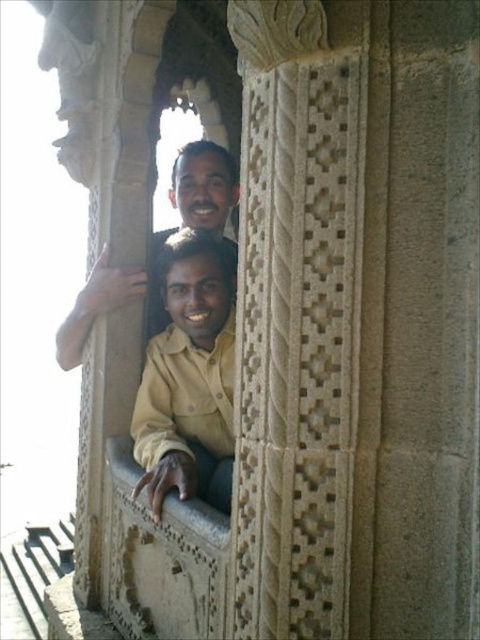
Is light brown fabric shirt at lower center shorter than matte beige shirt at center?

No.

Is point (220, 449) positioned before point (197, 182)?

Yes, it is.

In order to click on light brown fabric shirt at lower center in this screenshot , I will do `click(188, 371)`.

Which is below, light brown fabric shirt at lower center or white stone window sill at center?

white stone window sill at center

The image size is (480, 640). What are the coordinates of `light brown fabric shirt at lower center` in the screenshot? It's located at point(188,371).

Is point (177, 156) farther from camera compared to point (117, 440)?

Yes, point (177, 156) is behind point (117, 440).

Is point (181, 176) farther from viewer compared to point (139, 502)?

Yes, it is.

Find the location of a particular element. The height and width of the screenshot is (640, 480). matte beige shirt at center is located at coordinates (204, 186).